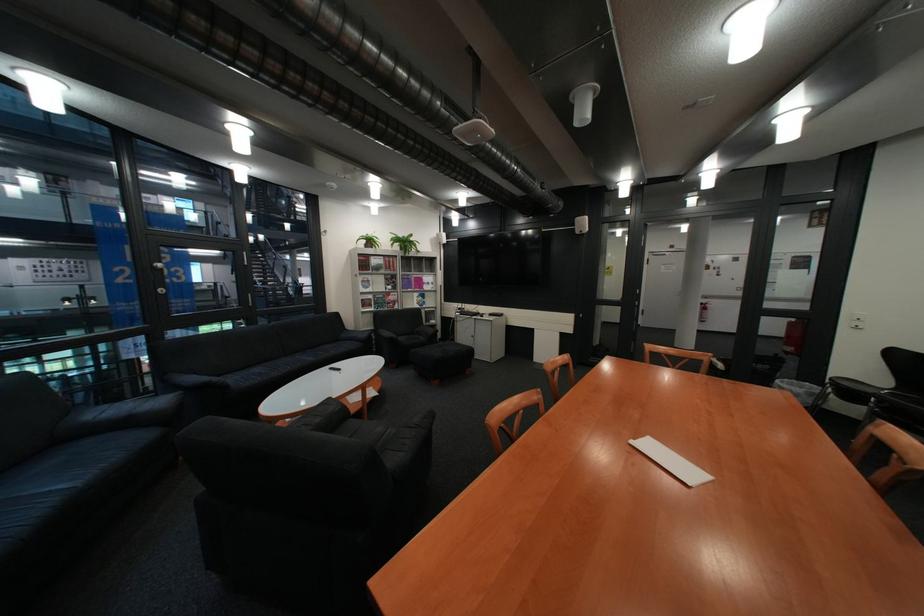
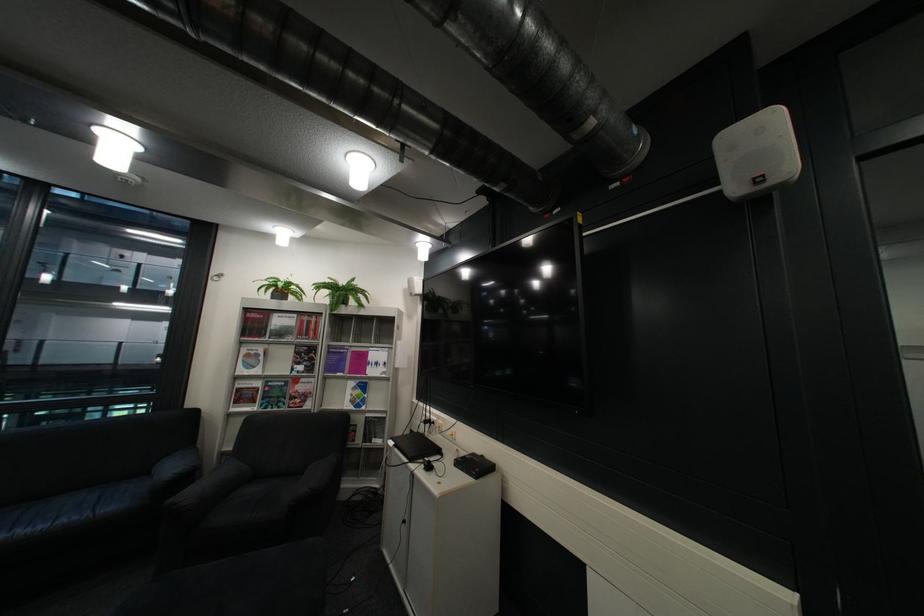
Where in the second image is the point corresponding to (x=456, y=243) from the first image?

(427, 294)